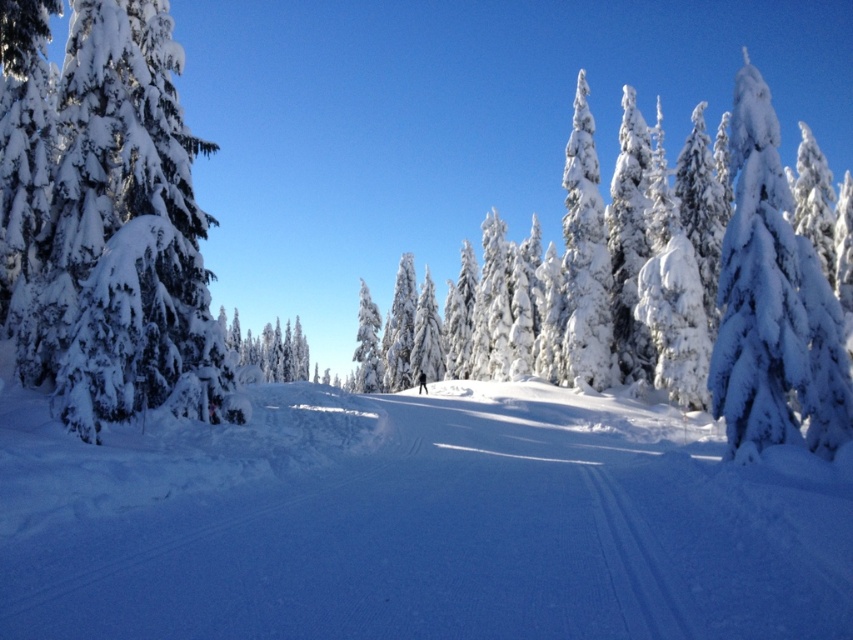
Question: Is white snow ski slope at center behind white fluffy snow-covered tree at left?

Choices:
 (A) yes
 (B) no

Answer: (B)

Question: Does white snow-covered trees at center have a greater width compared to white fluffy snow-covered tree at left?

Choices:
 (A) yes
 (B) no

Answer: (A)

Question: Is white snow ski slope at center smaller than white snow-covered trees at center?

Choices:
 (A) no
 (B) yes

Answer: (B)

Question: Which of the following is the closest to the observer?

Choices:
 (A) (141, 244)
 (B) (422, 378)
 (C) (259, 362)
 (D) (299, 465)

Answer: (A)

Question: Which point is farther from the camera taking this photo?

Choices:
 (A) tap(660, 525)
 (B) tap(45, 321)
 (C) tap(688, 298)

Answer: (C)

Question: Which point is closer to the camera?

Choices:
 (A) white snow-covered tree at center
 (B) white fluffy snow-covered tree at left

Answer: (B)